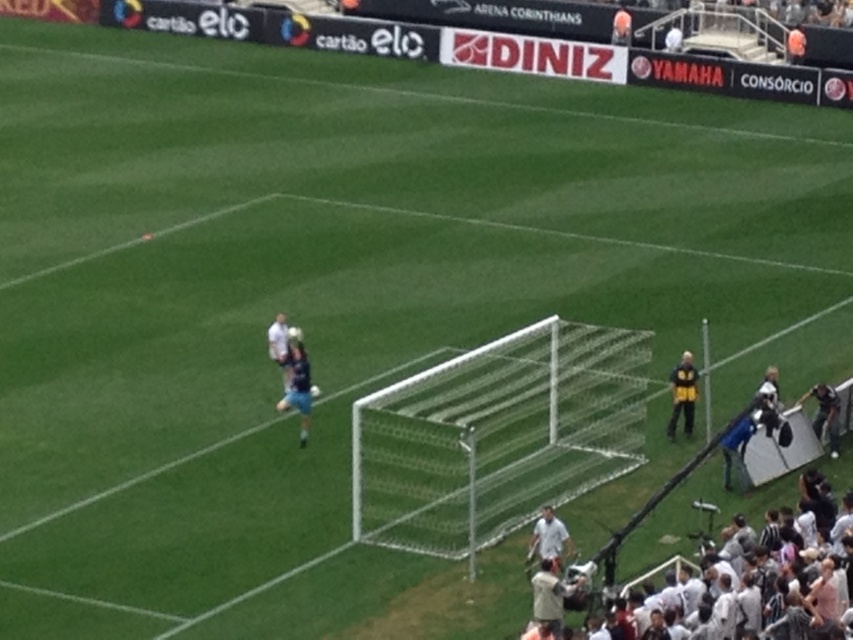
You are a photographer at the soccer match and want to capture a photo where both the white mesh net at center and the dark blue jersey at right are visible. Based on their positions, which object should you focus on first to ensure both are in frame?

The white mesh net at center might be wider than dark blue jersey at right, so focusing on the net first will help ensure both are in frame by adjusting the camera angle to include the dark blue jersey at right.

You are a photographer at the soccer match and want to capture both the white cotton crowd at lower right and the yellow jacket at right in a single shot. Which object will appear bigger in the photo?

The white cotton crowd at lower right will appear bigger in the photo because it is larger in size than the yellow jacket at right.